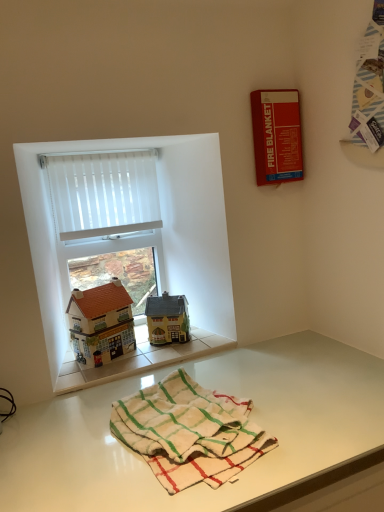
I want to click on free space that is in between matte brown house at left, the 1th toy from the left, and matte yellow house at center, which ranks as the first toy in right-to-left order, so click(139, 353).